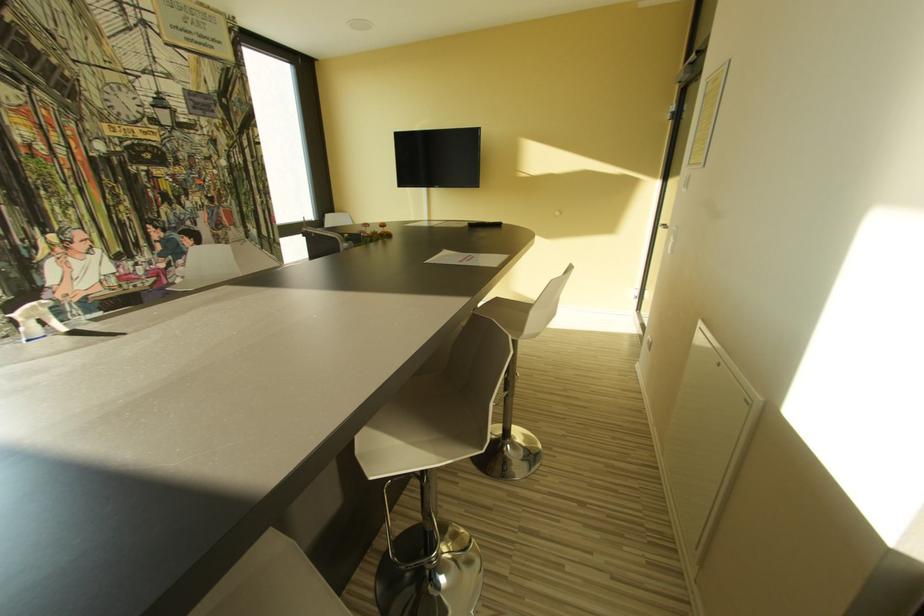
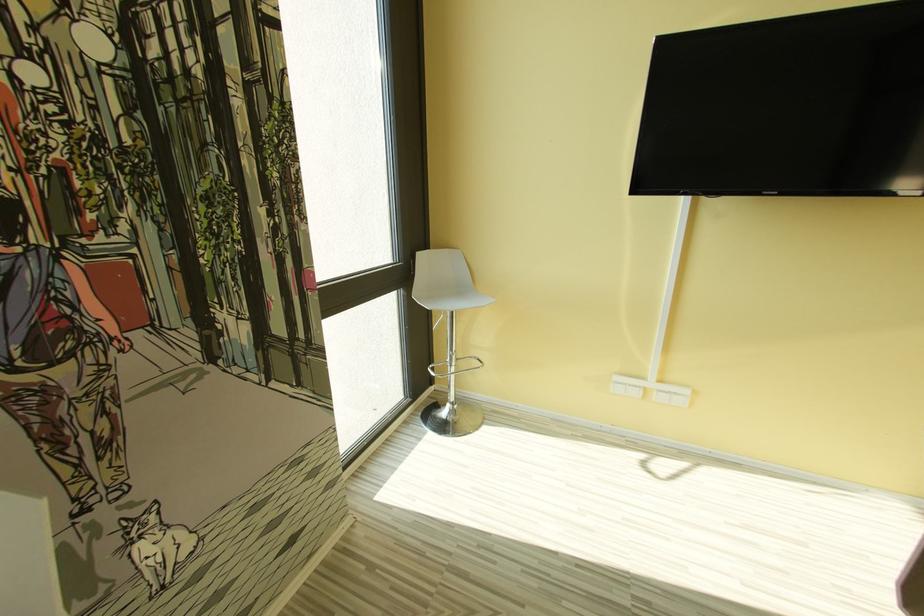
Which direction would the cameraman need to move to produce the second image?

The movement direction of the cameraman is left, forward.